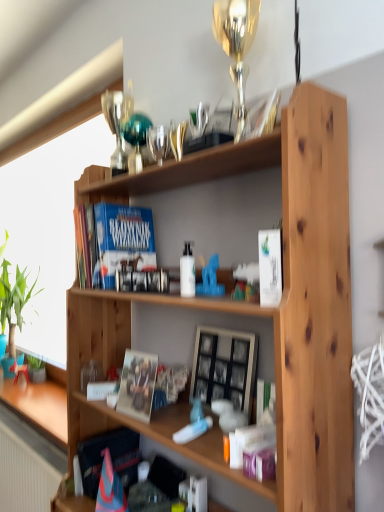
Question: Considering the relative positions of green leafy plant at left, positioned as the first houseplant in left-to-right order, and matte white coffee cup at lower left in the image provided, is green leafy plant at left, positioned as the first houseplant in left-to-right order, to the right of matte white coffee cup at lower left from the viewer's perspective?

Choices:
 (A) no
 (B) yes

Answer: (A)

Question: From the image's perspective, would you say green leafy plant at left, positioned as the first houseplant in left-to-right order, is shown under matte white coffee cup at lower left?

Choices:
 (A) no
 (B) yes

Answer: (A)

Question: Considering the relative sizes of green leafy plant at left, which appears as the second houseplant when ordered from the bottom, and matte white coffee cup at lower left in the image provided, is green leafy plant at left, which appears as the second houseplant when ordered from the bottom, wider than matte white coffee cup at lower left?

Choices:
 (A) no
 (B) yes

Answer: (B)

Question: From a real-world perspective, does green leafy plant at left, positioned as the first houseplant in left-to-right order, stand above matte white coffee cup at lower left?

Choices:
 (A) no
 (B) yes

Answer: (B)

Question: Can you confirm if green leafy plant at left, positioned as the first houseplant in left-to-right order, is thinner than matte white coffee cup at lower left?

Choices:
 (A) yes
 (B) no

Answer: (B)

Question: From the image's perspective, is matte white coffee cup at lower left positioned above or below green matte plant at lower left, which is the second houseplant in left-to-right order?

Choices:
 (A) above
 (B) below

Answer: (A)

Question: Relative to green matte plant at lower left, which is the second houseplant in left-to-right order, is matte white coffee cup at lower left in front or behind?

Choices:
 (A) front
 (B) behind

Answer: (A)

Question: Would you say matte white coffee cup at lower left is inside or outside green matte plant at lower left, acting as the 1th houseplant starting from the bottom?

Choices:
 (A) inside
 (B) outside

Answer: (B)

Question: From a real-world perspective, relative to green matte plant at lower left, placed as the 1th houseplant when sorted from front to back, is matte white coffee cup at lower left vertically above or below?

Choices:
 (A) above
 (B) below

Answer: (A)

Question: From the image's perspective, is matte paper photo frame at center above or below wooden picture frame at center?

Choices:
 (A) below
 (B) above

Answer: (A)

Question: In terms of size, does matte paper photo frame at center appear bigger or smaller than wooden picture frame at center?

Choices:
 (A) big
 (B) small

Answer: (B)

Question: In the image, is matte paper photo frame at center on the left side or the right side of wooden picture frame at center?

Choices:
 (A) left
 (B) right

Answer: (A)

Question: Looking at their shapes, would you say matte paper photo frame at center is wider or thinner than wooden picture frame at center?

Choices:
 (A) wide
 (B) thin

Answer: (B)

Question: In terms of width, does wooden picture frame at center look wider or thinner when compared to green leafy plant at left, arranged as the 1th houseplant when viewed from the back?

Choices:
 (A) thin
 (B) wide

Answer: (A)

Question: Is wooden picture frame at center taller or shorter than green leafy plant at left, arranged as the 1th houseplant when viewed from the back?

Choices:
 (A) short
 (B) tall

Answer: (A)